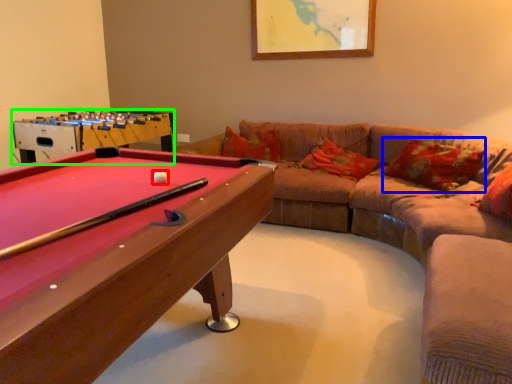
Question: Which object is positioned farthest from ball (highlighted by a red box)? Select from pillow (highlighted by a blue box) and table (highlighted by a green box).

Choices:
 (A) pillow
 (B) table

Answer: (A)